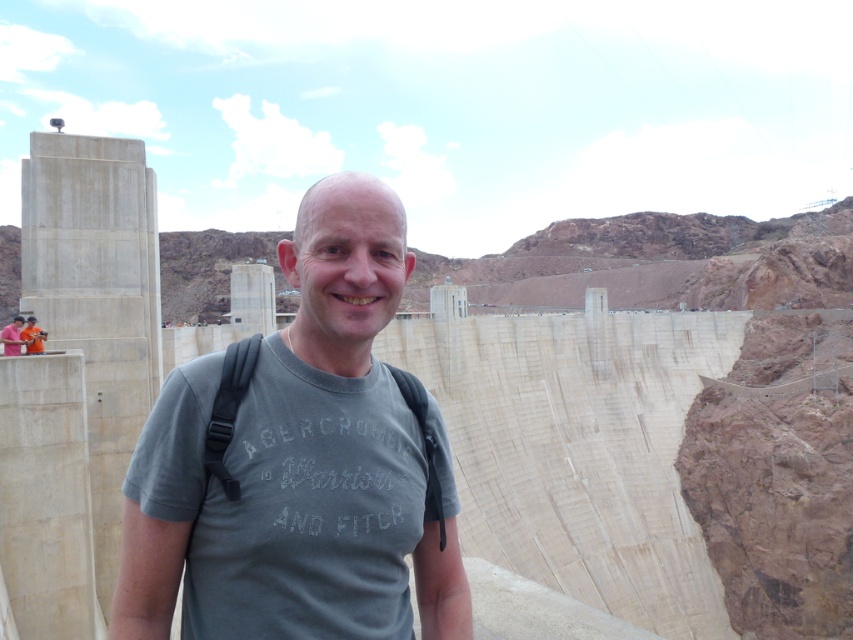
You are a photographer trying to capture the man in front of the dam. The gray cotton t shirt at center is represented by point (329, 456). Where should you position your camera to ensure the gray cotton t shirt at center is centered in your photo?

To center the gray cotton t shirt at center in the photo, position the camera so that the point (329, 456) aligns with the center of the frame.